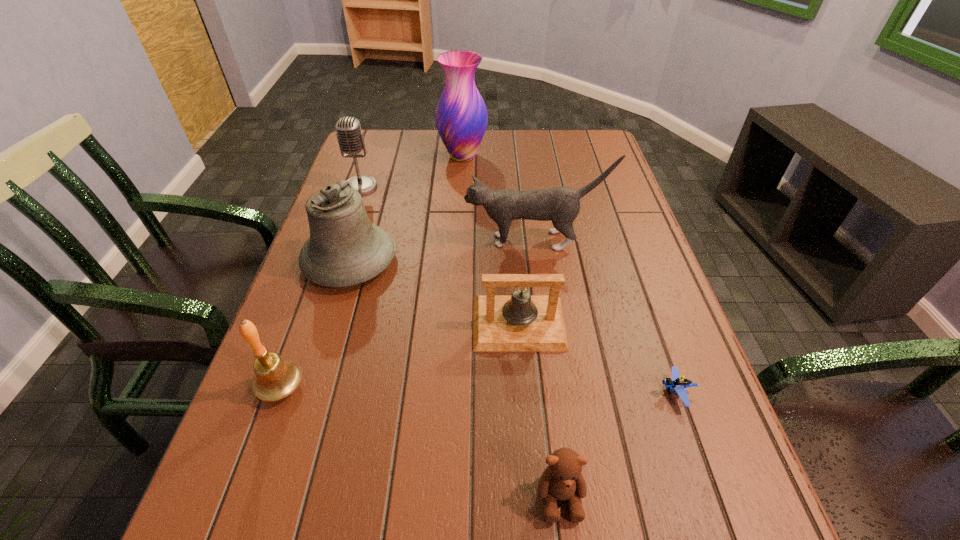
Where is `vacant space at the far right corner of the desktop`? vacant space at the far right corner of the desktop is located at coordinates (x=579, y=133).

Locate an element on the screen. vacant area that lies between the shortest bell and the shortest object is located at coordinates (597, 358).

Locate an element on the screen. vacant area that lies between the second shortest object and the cat is located at coordinates (547, 368).

At what (x,y) coordinates should I click in order to perform the action: click on empty location between the Lego and the shortest bell. Please return your answer as a coordinate pair (x, y). This screenshot has width=960, height=540. Looking at the image, I should click on (597, 358).

Image resolution: width=960 pixels, height=540 pixels. In order to click on free spot between the teddy bear and the sixth tallest object in this screenshot , I will do `click(540, 410)`.

The width and height of the screenshot is (960, 540). Find the location of `free space between the shortest bell and the farthest bell`. free space between the shortest bell and the farthest bell is located at coordinates (435, 292).

This screenshot has height=540, width=960. I want to click on free spot between the nearest bell and the seventh nearest object, so click(x=321, y=287).

Where is `free space between the microphone and the nearest bell`? This screenshot has height=540, width=960. free space between the microphone and the nearest bell is located at coordinates (321, 287).

Locate which object ranks fifth in proximity to the tallest object. Please provide its 2D coordinates. Your answer should be formatted as a tuple, i.e. [(x, y)], where the tuple contains the x and y coordinates of a point satisfying the conditions above.

[(275, 379)]

What are the coordinates of `object that can be found as the closest to the teddy bear` in the screenshot? It's located at (678, 383).